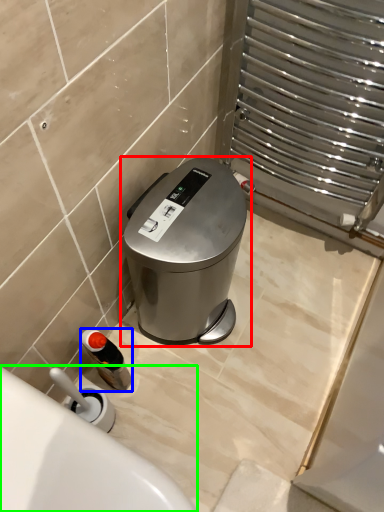
Question: Which object is the farthest from waste container (highlighted by a red box)? Choose among these: bottle (highlighted by a blue box) or bath (highlighted by a green box).

Choices:
 (A) bottle
 (B) bath

Answer: (B)